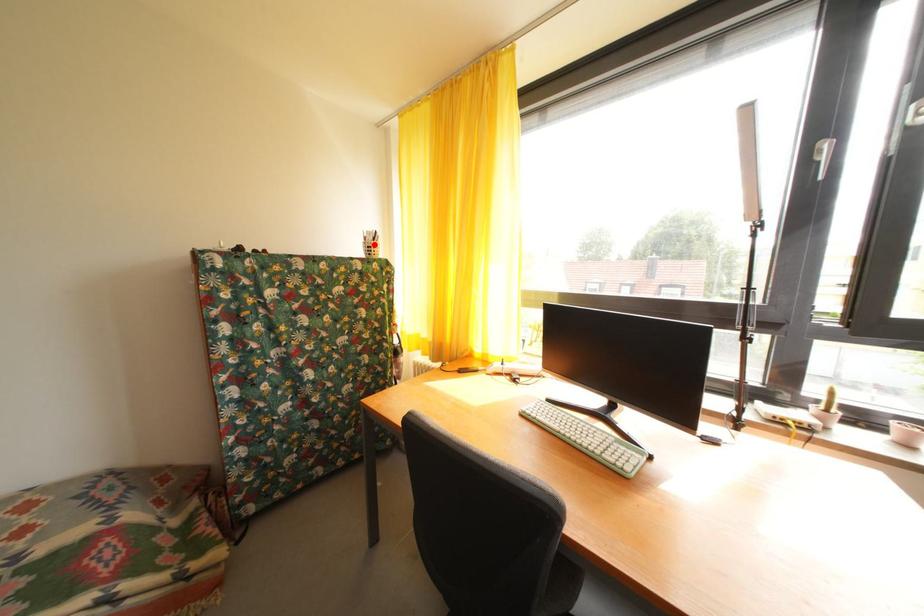
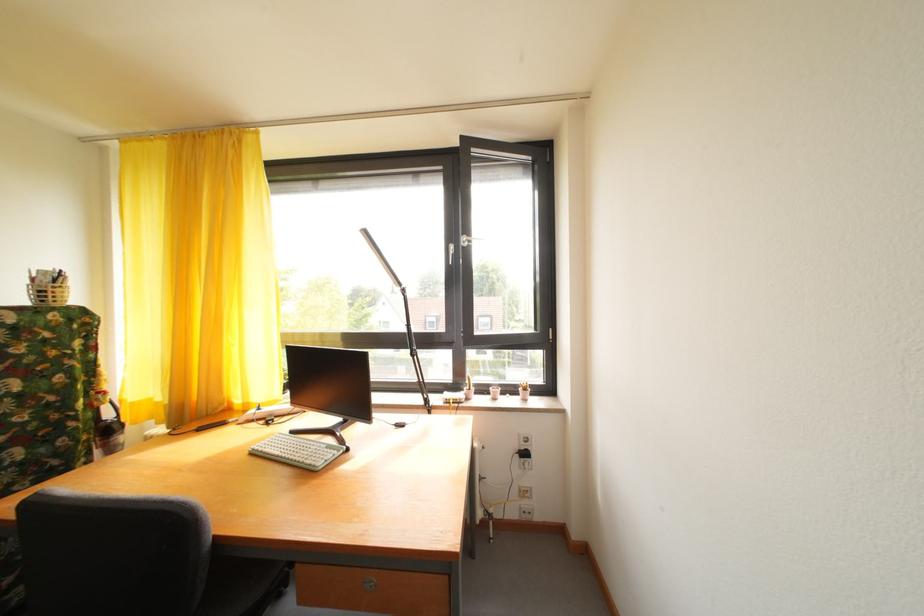
Where in the second image is the point corresponding to the highlighted location from the first image?

(43, 286)